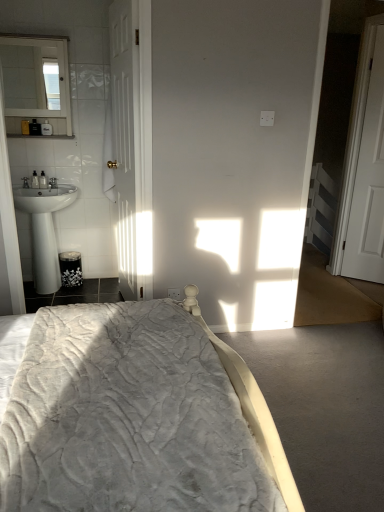
Question: From the image's perspective, is white wooden door at left, the 1th door positioned from the left, above or below white glossy mirror at upper left?

Choices:
 (A) below
 (B) above

Answer: (A)

Question: Choose the correct answer: Is white wooden door at left, the 1th door positioned from the left, inside white glossy mirror at upper left or outside it?

Choices:
 (A) outside
 (B) inside

Answer: (A)

Question: Estimate the real-world distances between objects in this image. Which object is closer to the white glossy sink at left?

Choices:
 (A) velvet grey bed at center
 (B) white wooden door at left, which is counted as the 2th door, starting from the right
 (C) white glossy mirror at upper left
 (D) white wooden door at right, which appears as the 2th door when viewed from the left

Answer: (B)

Question: Based on their relative distances, which object is farther from the white glossy sink at left?

Choices:
 (A) white wooden door at left, the 1th door positioned from the left
 (B) white glossy mirror at upper left
 (C) velvet grey bed at center
 (D) white wooden door at right, which appears as the 2th door when viewed from the left

Answer: (D)